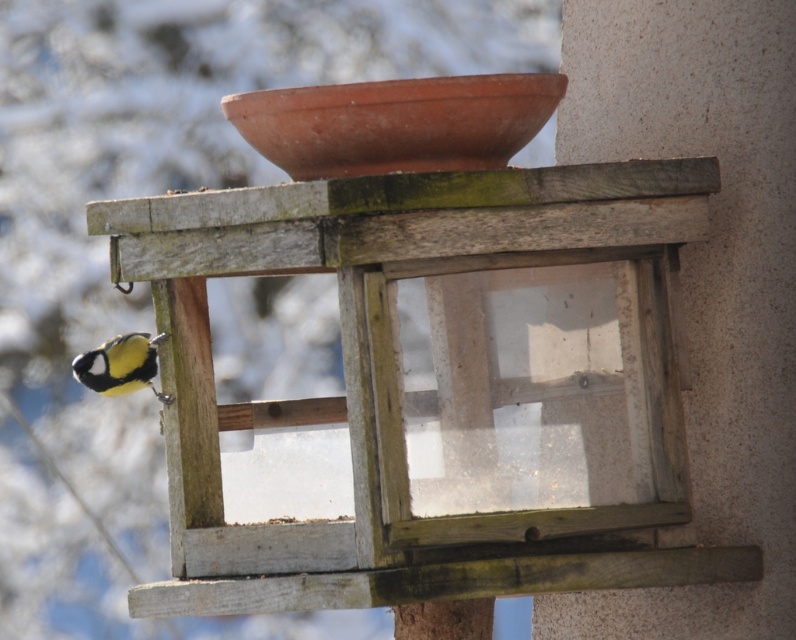
Question: Where is wooden bird feeder at left located in relation to yellow matte bird at lower left in the image?

Choices:
 (A) above
 (B) below

Answer: (B)

Question: Can you confirm if wooden bird feeder at left is smaller than yellow matte bird at lower left?

Choices:
 (A) no
 (B) yes

Answer: (A)

Question: Can you confirm if wooden bird feeder at left is bigger than yellow matte bird at lower left?

Choices:
 (A) no
 (B) yes

Answer: (B)